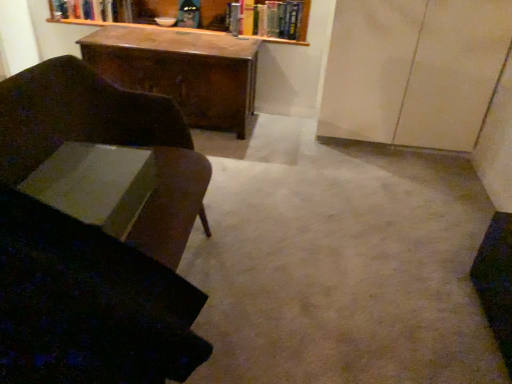
Question: Is matte beige cabinet at right taller than velvet dark brown chair at left?

Choices:
 (A) yes
 (B) no

Answer: (A)

Question: Can you confirm if matte beige cabinet at right is smaller than velvet dark brown chair at left?

Choices:
 (A) yes
 (B) no

Answer: (A)

Question: Is matte beige cabinet at right thinner than velvet dark brown chair at left?

Choices:
 (A) no
 (B) yes

Answer: (B)

Question: Is matte beige cabinet at right at the right side of velvet dark brown chair at left?

Choices:
 (A) no
 (B) yes

Answer: (B)

Question: Does matte beige cabinet at right contain velvet dark brown chair at left?

Choices:
 (A) no
 (B) yes

Answer: (A)

Question: Is matte beige cabinet at right facing towards velvet dark brown chair at left?

Choices:
 (A) no
 (B) yes

Answer: (B)

Question: Is velvet dark brown swivel chair at left at the right side of velvet dark brown chair at left?

Choices:
 (A) no
 (B) yes

Answer: (B)

Question: From a real-world perspective, is velvet dark brown swivel chair at left located beneath velvet dark brown chair at left?

Choices:
 (A) yes
 (B) no

Answer: (B)

Question: Can we say velvet dark brown swivel chair at left lies outside velvet dark brown chair at left?

Choices:
 (A) no
 (B) yes

Answer: (A)

Question: From a real-world perspective, is velvet dark brown swivel chair at left on top of velvet dark brown chair at left?

Choices:
 (A) no
 (B) yes

Answer: (B)

Question: From the image's perspective, is velvet dark brown swivel chair at left above velvet dark brown chair at left?

Choices:
 (A) no
 (B) yes

Answer: (A)

Question: Does velvet dark brown swivel chair at left have a lesser width compared to velvet dark brown chair at left?

Choices:
 (A) no
 (B) yes

Answer: (A)

Question: Is white paper at lower left, the 1th book positioned from the bottom, turned away from wooden desk at center?

Choices:
 (A) yes
 (B) no

Answer: (B)